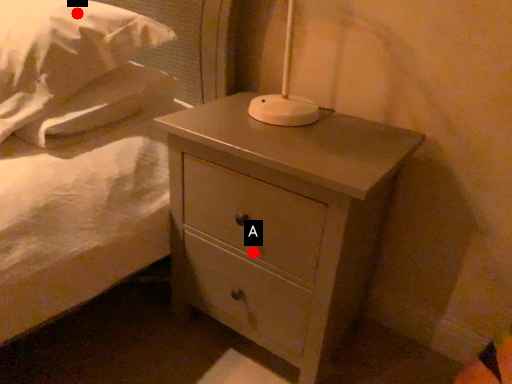
Question: Two points are circled on the image, labeled by A and B beside each circle. Which point appears closest to the camera in this image?

Choices:
 (A) A is closer
 (B) B is closer

Answer: (A)